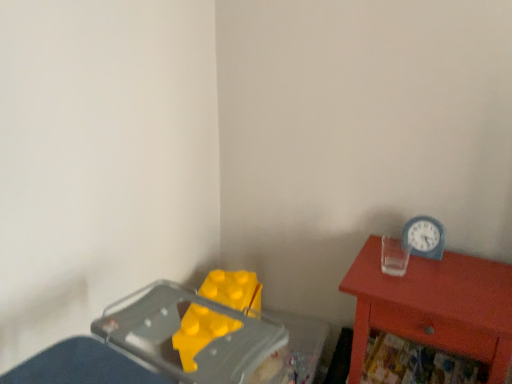
Locate an element on the screen. The image size is (512, 384). vacant space that is to the left of blue plastic clock at upper right is located at coordinates (382, 259).